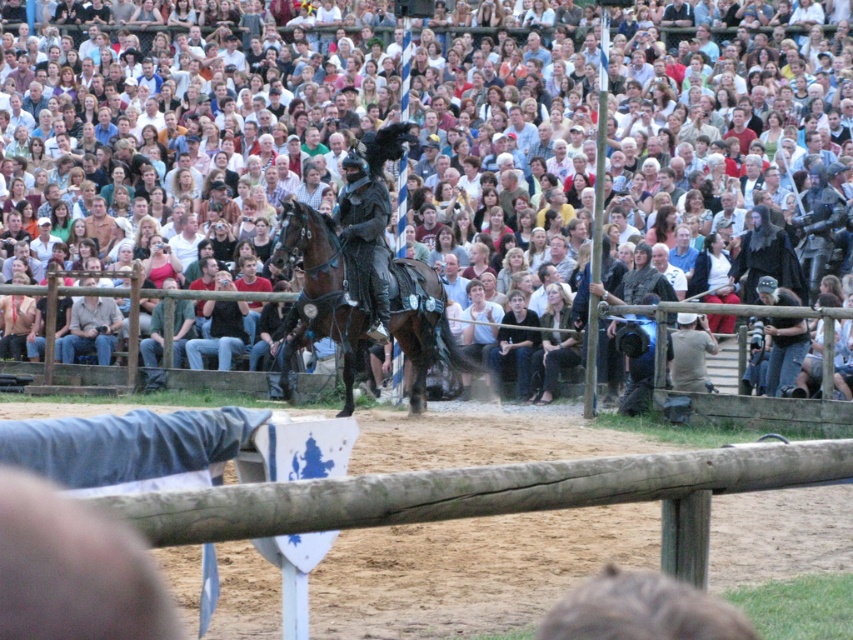
You are a knight preparing to enter the arena for a jousting match. You see the shiny brown horse at center and the wooden at center. Which one is more likely to be the obstacle you need to avoid while riding?

The wooden at center is larger, so it is more likely to be the obstacle you need to avoid while riding the shiny brown horse at center.

You are a spectator standing behind the wooden fence at the edge of the arena. You want to take a photo of the shiny brown horse at center without any obstructions. Since the wooden at center is in the way, can you still take the photo if you aim upwards?

The shiny brown horse at center is located above the wooden at center, so aiming upwards should allow you to take a clear photo of the shiny brown horse at center without obstruction from the wooden at center.

You are a spectator at the medieval event and want to know which item is shorter between the dark gray fabric at lower center and the dark blue jeans at lower center. Can you tell me?

The dark gray fabric at lower center is shorter than the dark blue jeans at lower center according to the description.